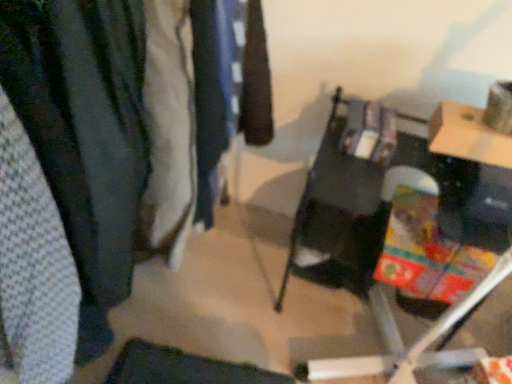
Question: Is white textured fabric at left, which is the 2th clothing in back-to-front order, outside dark blue fabric at center, arranged as the second clothing when viewed from the left?

Choices:
 (A) yes
 (B) no

Answer: (A)

Question: From a real-world perspective, is white textured fabric at left, marked as the second clothing in a right-to-left arrangement, over dark blue fabric at center, which is the 1th clothing from back to front?

Choices:
 (A) no
 (B) yes

Answer: (B)

Question: Is white textured fabric at left, marked as the second clothing in a right-to-left arrangement, bigger than dark blue fabric at center, which is the 1th clothing from back to front?

Choices:
 (A) yes
 (B) no

Answer: (A)

Question: Is white textured fabric at left, the first clothing viewed from the left, placed right next to dark blue fabric at center, which is the 1th clothing from back to front?

Choices:
 (A) yes
 (B) no

Answer: (B)

Question: From a real-world perspective, is white textured fabric at left, which is the 1th clothing in front-to-back order, physically below dark blue fabric at center, acting as the 1th clothing starting from the right?

Choices:
 (A) no
 (B) yes

Answer: (A)

Question: Is white textured fabric at left, marked as the second clothing in a right-to-left arrangement, far away from dark blue fabric at center, arranged as the second clothing when viewed from the left?

Choices:
 (A) yes
 (B) no

Answer: (B)

Question: From the image's perspective, would you say dark blue fabric at center, arranged as the second clothing when viewed from the left, is shown under white textured fabric at left, which is the 2th clothing in back-to-front order?

Choices:
 (A) yes
 (B) no

Answer: (B)

Question: Is dark blue fabric at center, arranged as the second clothing when viewed from the left, closer to the viewer compared to white textured fabric at left, marked as the second clothing in a right-to-left arrangement?

Choices:
 (A) no
 (B) yes

Answer: (A)

Question: Is white textured fabric at left, which is the 1th clothing in front-to-back order, inside dark blue fabric at center, arranged as the second clothing when viewed from the left?

Choices:
 (A) yes
 (B) no

Answer: (B)

Question: From a real-world perspective, is dark blue fabric at center, which is the 1th clothing from back to front, positioned over white textured fabric at left, the first clothing viewed from the left, based on gravity?

Choices:
 (A) no
 (B) yes

Answer: (A)

Question: Are dark blue fabric at center, arranged as the second clothing when viewed from the left, and white textured fabric at left, which is the 1th clothing in front-to-back order, beside each other?

Choices:
 (A) yes
 (B) no

Answer: (B)

Question: Is dark blue fabric at center, which is the 1th clothing from back to front, oriented towards white textured fabric at left, the first clothing viewed from the left?

Choices:
 (A) no
 (B) yes

Answer: (A)

Question: Can you confirm if matte black table at center is smaller than textured fabric closet at left?

Choices:
 (A) yes
 (B) no

Answer: (B)